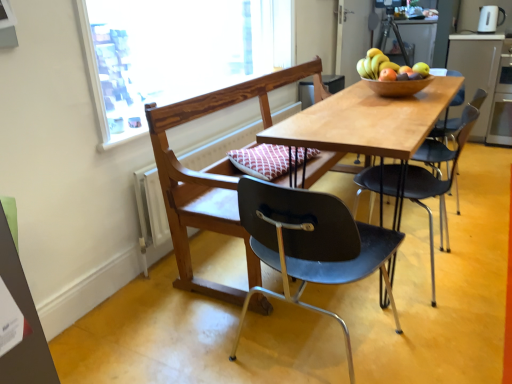
At what (x,y) coordinates should I click in order to perform the action: click on vacant space that's between matte black chair at center, which is the 3th chair from front to back, and wooden table at center. Please return your answer as a coordinate pair (x, y). Image resolution: width=512 pixels, height=384 pixels. Looking at the image, I should click on pos(444,246).